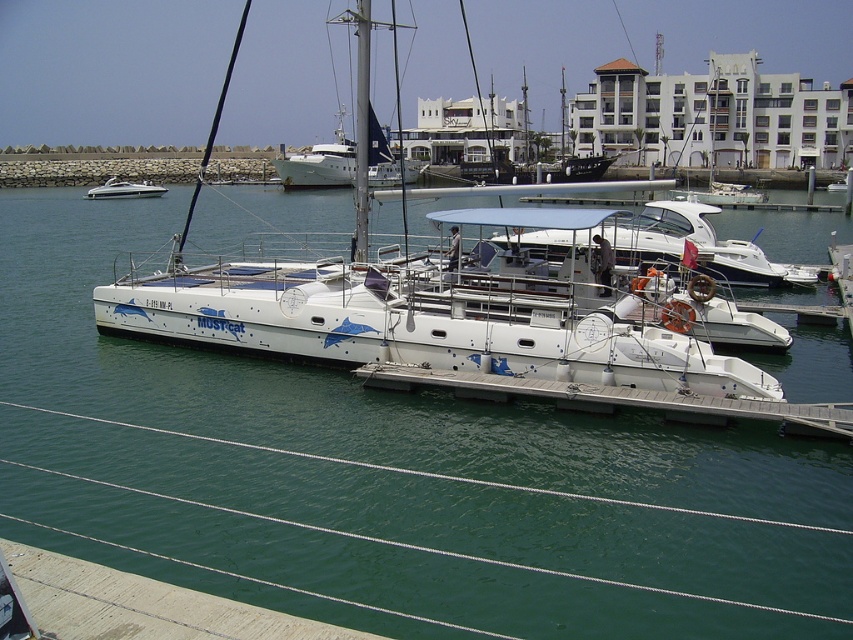
Question: Is white glossy catamaran at center below white glossy speedboat at left?

Choices:
 (A) yes
 (B) no

Answer: (A)

Question: Is smooth concrete dock at lower left bigger than white glossy catamaran at center?

Choices:
 (A) no
 (B) yes

Answer: (A)

Question: In this image, where is white glossy water at center located relative to white matte sailboat at center?

Choices:
 (A) below
 (B) above

Answer: (A)

Question: Which object appears closest to the camera in this image?

Choices:
 (A) white glossy sailboat at center
 (B) white glossy water at center

Answer: (B)

Question: Which point is closer to the camera?

Choices:
 (A) (412, 403)
 (B) (309, 182)
 (C) (96, 196)
 (D) (596, 397)

Answer: (D)

Question: Which is nearer to the white glossy catamaran at center?

Choices:
 (A) white matte sailboat at center
 (B) white concrete dock at lower center
 (C) white glossy water at center
 (D) white glossy speedboat at left

Answer: (C)